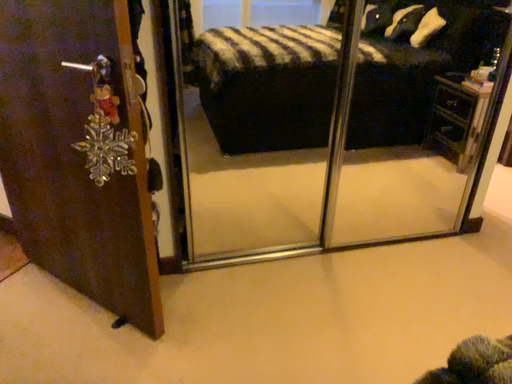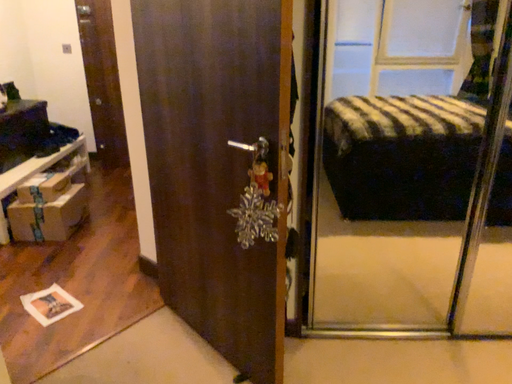
Question: How did the camera likely rotate when shooting the video?

Choices:
 (A) rotated upward
 (B) rotated downward

Answer: (A)